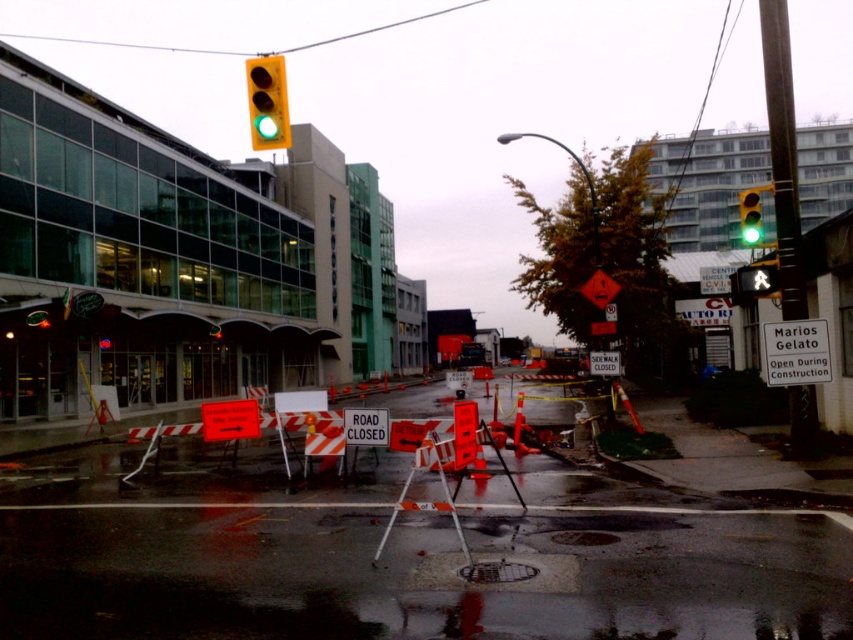
Can you confirm if metallic pole at right is positioned above orange reflective road sign at center?

Yes.

Based on the photo, which is below, metallic pole at right or orange reflective road sign at center?

Positioned lower is orange reflective road sign at center.

This screenshot has height=640, width=853. I want to click on metallic pole at right, so click(782, 156).

Locate an element on the screen. metallic pole at right is located at coordinates (782, 156).

Can you confirm if white plastic barricades at center is positioned above metallic pole at right?

Incorrect, white plastic barricades at center is not positioned above metallic pole at right.

Is point (498, 486) closer to viewer compared to point (784, 220)?

Yes, it is.

Find the location of a particular element. white plastic barricades at center is located at coordinates (405, 556).

Is point (791, 236) closer to camera compared to point (263, 106)?

No, (791, 236) is further to viewer.

Does metallic pole at right appear on the left side of green matte traffic light at upper center?

Incorrect, metallic pole at right is not on the left side of green matte traffic light at upper center.

Between point (762, 36) and point (260, 84), which one is positioned behind?

Point (762, 36)

What are the coordinates of `metallic pole at right` in the screenshot? It's located at (782, 156).